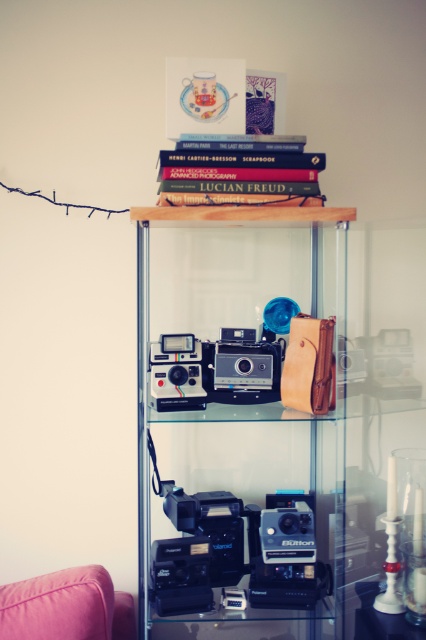
You are a museum curator planning to move the hardcover book at upper center closer to the satin silver camera at center for an exhibition. The display cabinet has a 17 inch wide shelf. Can the book and camera be placed side by side without exceeding the shelf width?

The hardcover book at upper center and satin silver camera at center are 16.53 inches apart. Since the shelf is 17 inches wide, there is enough space to place them side by side as 16.53 is less than 17.

You are a photographer trying to place a matte black camera at center into a transparent glass cabinet at center. Can the camera fit inside the cabinet?

The transparent glass cabinet at center is wider than the matte black camera at center, so the camera can fit inside the cabinet.

You are standing in front of the display cabinet described in the scene. There is a point marked at coordinates (273, 438). Which object in the cabinet does this point correspond to?

The point at (273, 438) corresponds to the transparent glass cabinet at center.